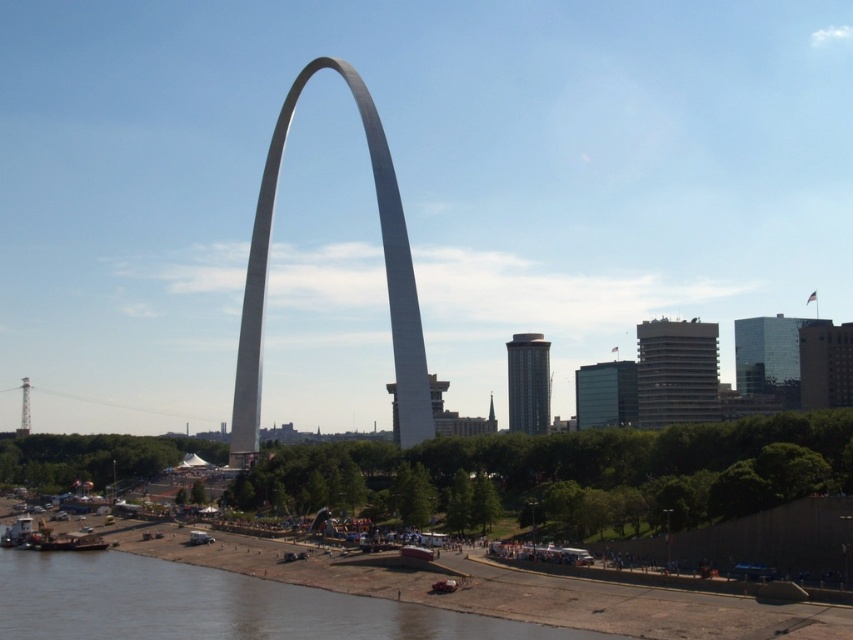
What do you see at coordinates (213, 605) in the screenshot? This screenshot has height=640, width=853. I see `brown sedimentary river at lower center` at bounding box center [213, 605].

Between point (4, 579) and point (366, 124), which one is positioned in front?

Positioned in front is point (4, 579).

Describe the element at coordinates (213, 605) in the screenshot. I see `brown sedimentary river at lower center` at that location.

Identify the location of brown sedimentary river at lower center. This screenshot has width=853, height=640. (213, 605).